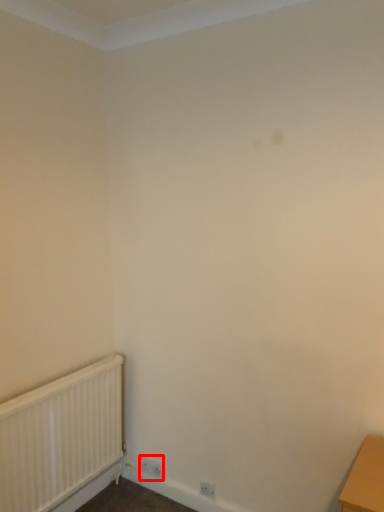
Question: From the image's perspective, what is the correct spatial relationship of electric outlet (annotated by the red box) in relation to radiator?

Choices:
 (A) below
 (B) above

Answer: (A)